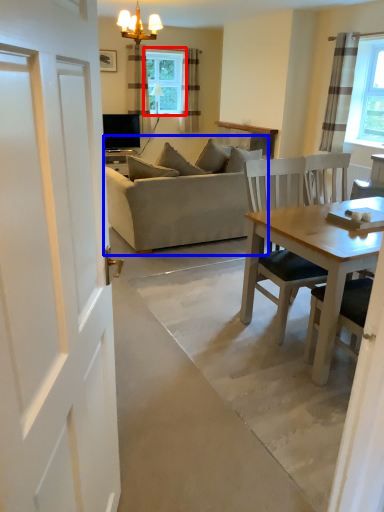
Question: Among these objects, which one is farthest to the camera, window (highlighted by a red box) or studio couch (highlighted by a blue box)?

Choices:
 (A) window
 (B) studio couch

Answer: (A)